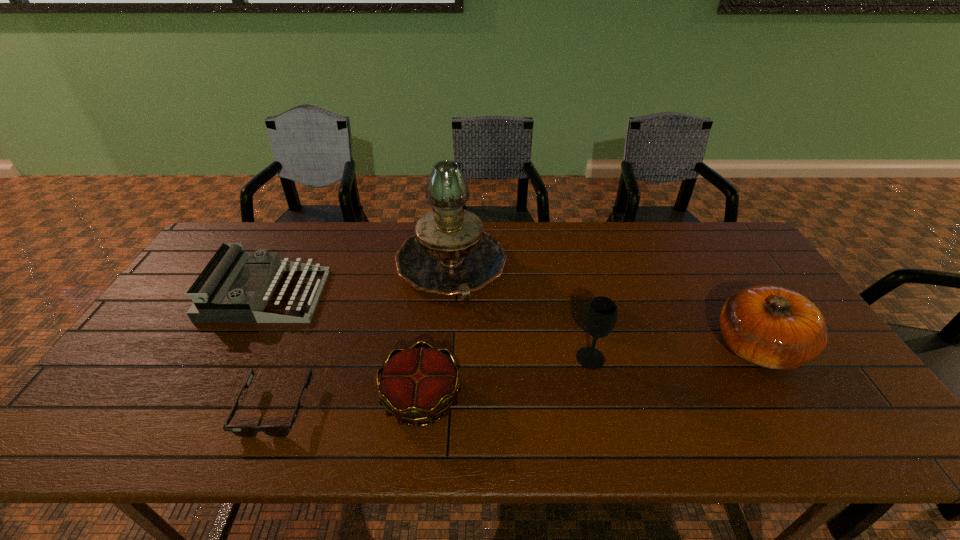
At what (x,y) coordinates should I click in order to perform the action: click on vacant space located 0.320m on the left of the crown. Please return your answer as a coordinate pair (x, y). Image resolution: width=960 pixels, height=540 pixels. Looking at the image, I should click on (247, 399).

The height and width of the screenshot is (540, 960). Identify the location of object at the far edge. (450, 254).

Find the location of `crown that is at the near edge`. crown that is at the near edge is located at coordinates (416, 384).

Find the location of `sunglasses that is at the near edge`. sunglasses that is at the near edge is located at coordinates (246, 431).

Locate an element on the screen. Image resolution: width=960 pixels, height=540 pixels. object that is at the left edge is located at coordinates (213, 300).

You are a GUI agent. You are given a task and a screenshot of the screen. Output one action in this format:
    pyautogui.click(x=<x>, y=<y>)
    Task: Click on the object present at the right edge
    Image resolution: width=960 pixels, height=540 pixels.
    Given the screenshot: What is the action you would take?
    pyautogui.click(x=772, y=327)

Locate an element on the screen. The width and height of the screenshot is (960, 540). free point at the far edge is located at coordinates (590, 230).

You are a GUI agent. You are given a task and a screenshot of the screen. Output one action in this format:
    pyautogui.click(x=<x>, y=<y>)
    Task: Click on the vacant space at the far left corner of the desktop
    
    Given the screenshot: What is the action you would take?
    pyautogui.click(x=266, y=238)

Where is `vacant space that is in between the oil lamp and the fifth object from left to right`? This screenshot has height=540, width=960. vacant space that is in between the oil lamp and the fifth object from left to right is located at coordinates (520, 312).

The height and width of the screenshot is (540, 960). What are the coordinates of `blank region between the tallest object and the shortest object` in the screenshot? It's located at (363, 337).